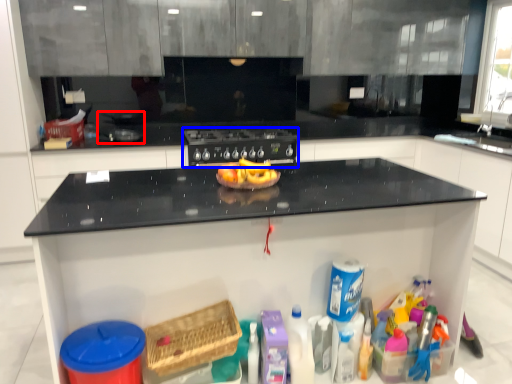
Question: Among these objects, which one is farthest to the camera, appliance (highlighted by a red box) or home appliance (highlighted by a blue box)?

Choices:
 (A) appliance
 (B) home appliance

Answer: (B)